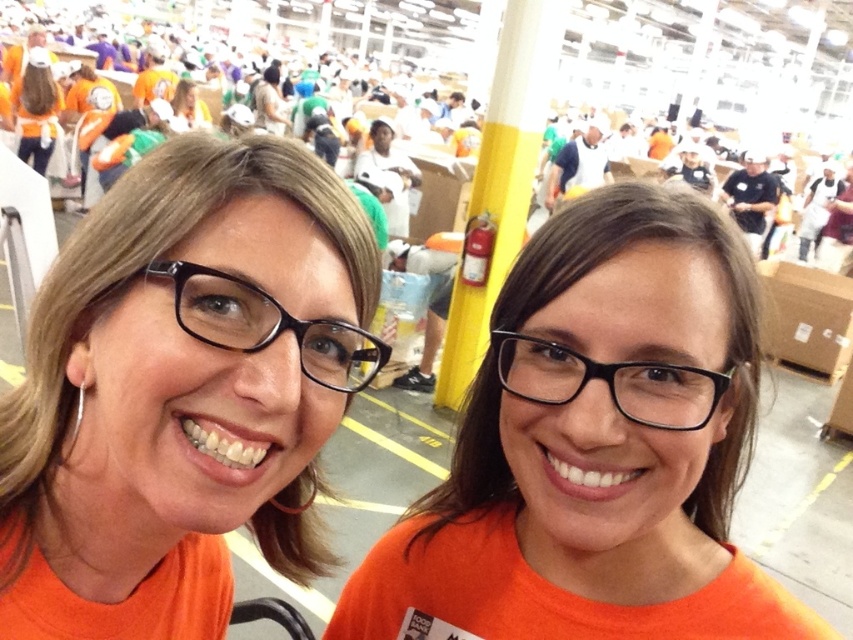
Is point (775, 627) farther from camera compared to point (22, 116)?

No, it is in front of (22, 116).

Who is lower down, orange matte shirt at center or matte orange shirt at upper left?

orange matte shirt at center is below.

Is point (614, 438) in front of point (48, 145)?

Yes, point (614, 438) is in front of point (48, 145).

Where is `orange matte shirt at center`? orange matte shirt at center is located at coordinates (595, 449).

Is black plastic glasses at left wider than matte orange shirt at upper left?

No.

Based on the photo, does black plastic glasses at left appear on the left side of matte orange shirt at upper left?

In fact, black plastic glasses at left is to the right of matte orange shirt at upper left.

Between point (221, 312) and point (51, 76), which one is positioned behind?

Point (51, 76)

Image resolution: width=853 pixels, height=640 pixels. I want to click on black plastic glasses at left, so click(x=267, y=324).

Does orange matte/softobject at left appear over black plastic glasses at center?

No.

At what (x,y) coordinates should I click in order to perform the action: click on orange matte/softobject at left. Please return your answer as a coordinate pair (x, y). The image size is (853, 640). Looking at the image, I should click on (173, 385).

Locate an element on the screen. orange matte/softobject at left is located at coordinates (173, 385).